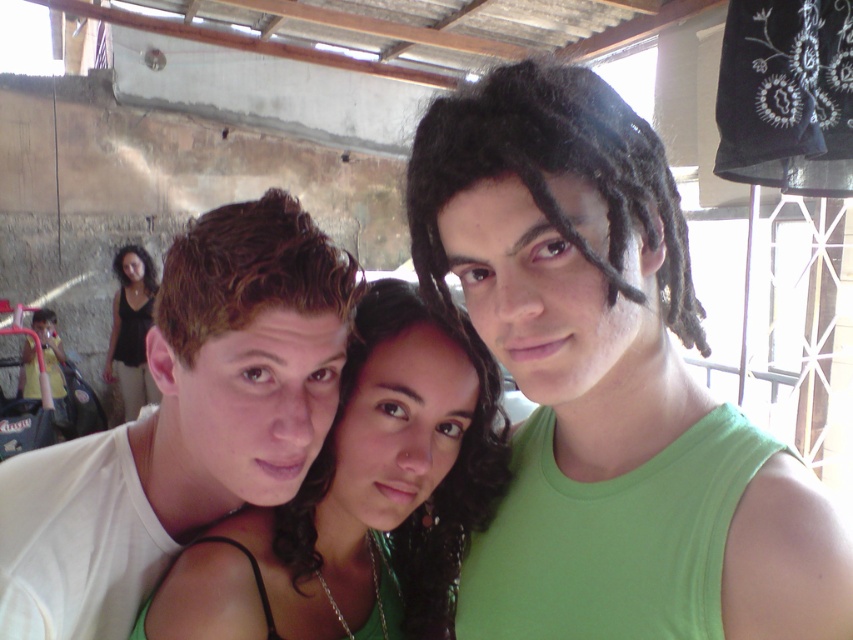
Is point (242, 424) more distant than point (125, 289)?

No.

Does white matte t-shirt at left lie in front of black fabric at left?

That is True.

This screenshot has width=853, height=640. Identify the location of white matte t-shirt at left. (184, 422).

Can you confirm if green matte tank top at center is positioned to the left of white matte t-shirt at left?

No, green matte tank top at center is not to the left of white matte t-shirt at left.

Can you confirm if green matte tank top at center is positioned below white matte t-shirt at left?

Incorrect, green matte tank top at center is not positioned below white matte t-shirt at left.

I want to click on green matte tank top at center, so click(607, 384).

Does green matte tank top at center have a smaller size compared to black fabric at left?

Correct, green matte tank top at center occupies less space than black fabric at left.

Where is `green matte tank top at center`? green matte tank top at center is located at coordinates (607, 384).

Locate an element on the screen. This screenshot has height=640, width=853. green matte tank top at center is located at coordinates (607, 384).